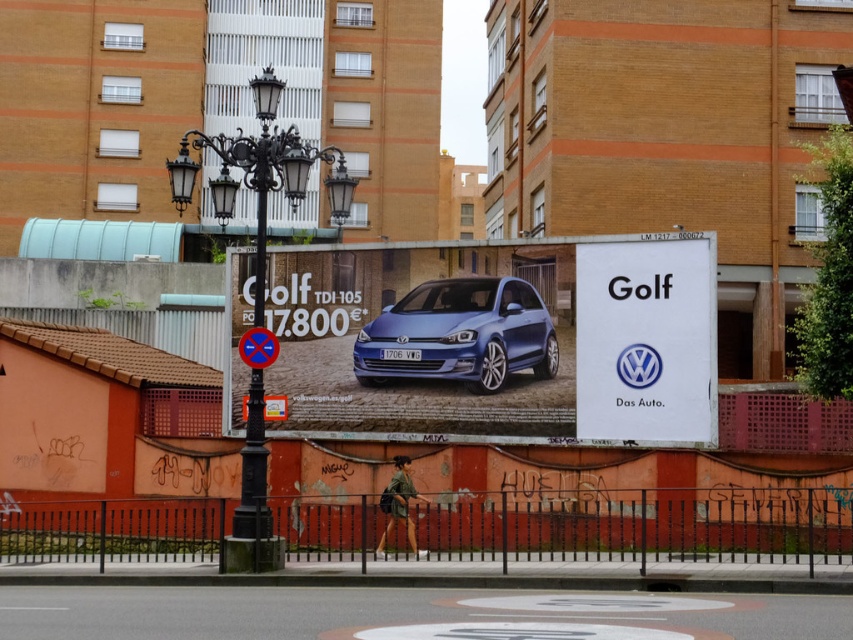
You are a photographer standing in front of the billboard advertisement for the Volkswagen Golf. You want to take a photo of the white paperboard at center without including the black lamppost in front of it. Based on their positions, is this possible?

The white paperboard at center is 25.51 meters from the camera. Since the black lamppost is in front of it, it is closer to the camera than the white paperboard. Therefore, if the photographer adjusts their angle or position to frame the shot so the lamppost is not blocking the view, it would be possible to capture the white paperboard without the lamppost in the frame.

You are a delivery person who needs to place a small package on the white paperboard at center. The delivery zone is defined as any area within the rectangle from point A at coordinates 0.5 to 0.5 up to point B at 0.6 to 0.8. Will the package be placed within the delivery zone?

The white paperboard at center is located at point (646, 340), which falls within the rectangle defined by points A (426, 320) and B (682, 384). Therefore, the package will be placed within the delivery zone.